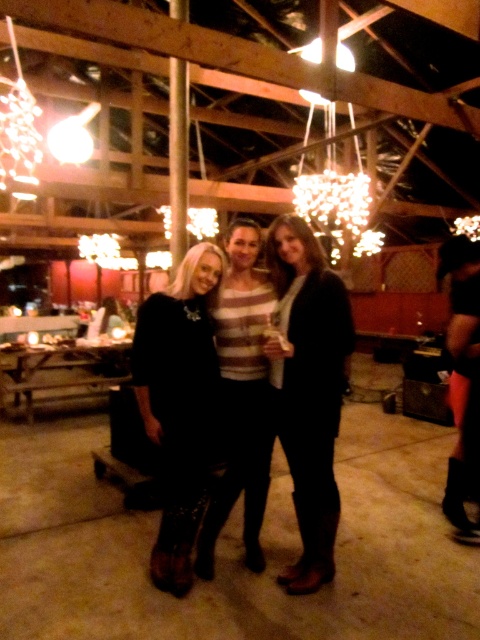
Does black leather pants at center lie behind striped sweater at center?

No, it is in front of striped sweater at center.

Does black leather pants at center have a greater height compared to striped sweater at center?

Yes, black leather pants at center is taller than striped sweater at center.

Does point (299, 280) come farther from viewer compared to point (238, 458)?

No, it is in front of (238, 458).

In order to click on black leather pants at center in this screenshot , I will do `click(309, 388)`.

How distant is black leather pants at center from black leather dress at center?

The distance of black leather pants at center from black leather dress at center is 18.53 inches.

Who is more forward, [323,262] or [162,552]?

Point [162,552]

What do you see at coordinates (309, 388) in the screenshot? I see `black leather pants at center` at bounding box center [309, 388].

This screenshot has width=480, height=640. Identify the location of black leather pants at center. (309, 388).

The width and height of the screenshot is (480, 640). What do you see at coordinates (180, 403) in the screenshot?
I see `black leather dress at center` at bounding box center [180, 403].

Which of these two, black leather dress at center or striped sweater at center, stands taller?

With more height is striped sweater at center.

Who is more forward, (171, 582) or (224, 369)?

Point (171, 582)

Where is `black leather dress at center`? The width and height of the screenshot is (480, 640). black leather dress at center is located at coordinates (180, 403).